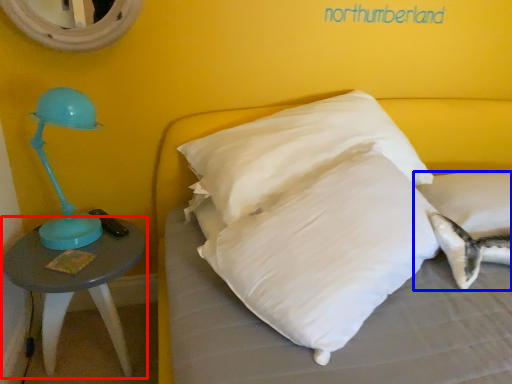
Question: Which object appears closest to the camera in this image, table (highlighted by a red box) or pillow (highlighted by a blue box)?

Choices:
 (A) table
 (B) pillow

Answer: (A)